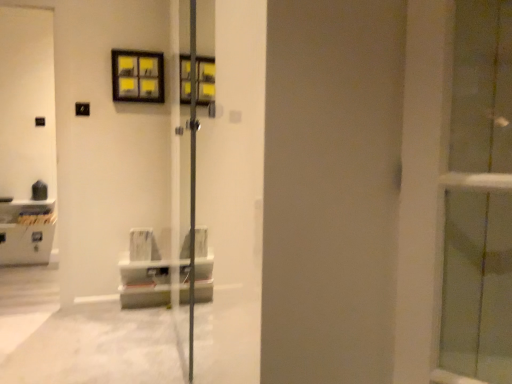
What do you see at coordinates (137, 76) in the screenshot? This screenshot has width=512, height=384. I see `wooden frame at upper center` at bounding box center [137, 76].

The width and height of the screenshot is (512, 384). Identify the location of wooden frame at upper center. (137, 76).

You are a GUI agent. You are given a task and a screenshot of the screen. Output one action in this format:
    pyautogui.click(x=<x>, y=<y>)
    Task: Click on the wooden frame at upper center
    The width and height of the screenshot is (512, 384).
    Given the screenshot: What is the action you would take?
    pyautogui.click(x=137, y=76)